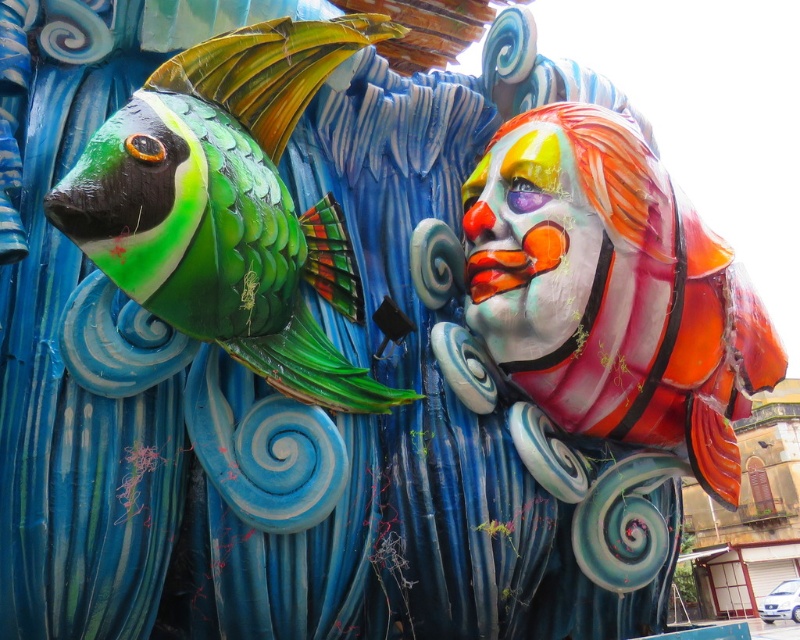
Who is positioned more to the left, shiny orange fish at right or matte clown face at right?

Positioned to the left is matte clown face at right.

Which is in front, point (538, 250) or point (540, 220)?

Positioned in front is point (538, 250).

The image size is (800, 640). I want to click on shiny orange fish at right, so click(x=602, y=301).

From the picture: Does matte painted clown head at right have a greater width compared to matte clown face at right?

Correct, the width of matte painted clown head at right exceeds that of matte clown face at right.

Which is below, matte painted clown head at right or matte clown face at right?

matte painted clown head at right is lower down.

Locate an element on the screen. The image size is (800, 640). matte painted clown head at right is located at coordinates (229, 205).

Which is above, shiny orange fish at right or matte painted clown head at right?

Positioned higher is matte painted clown head at right.

Is shiny orange fish at right smaller than matte painted clown head at right?

No, shiny orange fish at right is not smaller than matte painted clown head at right.

Who is more distant from viewer, (x=570, y=467) or (x=162, y=116)?

Point (x=570, y=467)

What are the coordinates of `shiny orange fish at right` in the screenshot? It's located at (602, 301).